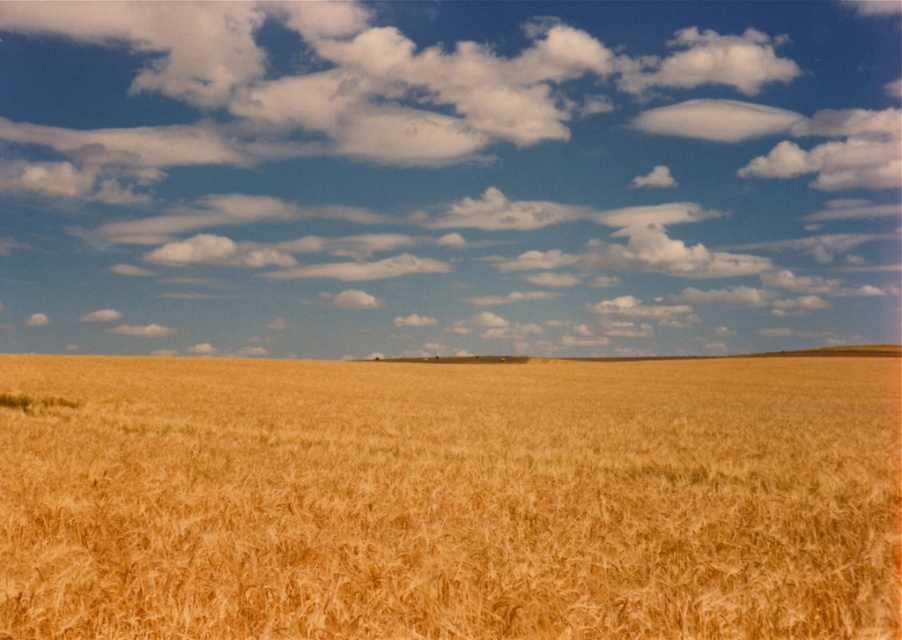
You are a drone operator flying a drone over the wheat fields. You need to drop a seed at point A and point B. Point A is at coordinates point (765, 320) and point B is at point (115, 360). If you release the seed at the same height, which point will the seed hit the ground first?

Point B at point (115, 360) will be hit first because it is closer to the ground than point A at point (765, 320).

You are a farmer looking at the wheat field and the cloud in the sky. Which object is positioned higher in the sky between the white fluffy cloud at upper center and the golden matte wheat field at center?

The white fluffy cloud at upper center is positioned higher in the sky than the golden matte wheat field at center.